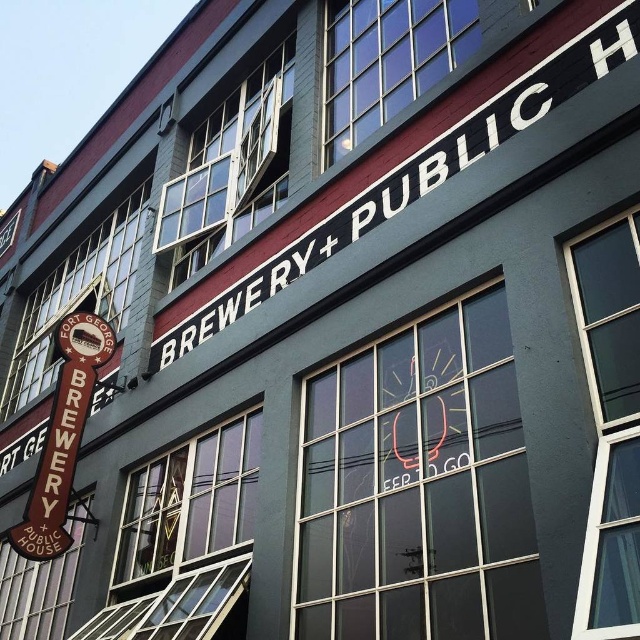
Can you confirm if white painted signboard at center is positioned below brown wooden sign at left?

No.

In the scene shown: Can you confirm if white painted signboard at center is bigger than brown wooden sign at left?

Incorrect, white painted signboard at center is not larger than brown wooden sign at left.

Which is behind, point (612, 49) or point (64, 550)?

Positioned behind is point (64, 550).

What are the coordinates of `white painted signboard at center` in the screenshot? It's located at (419, 173).